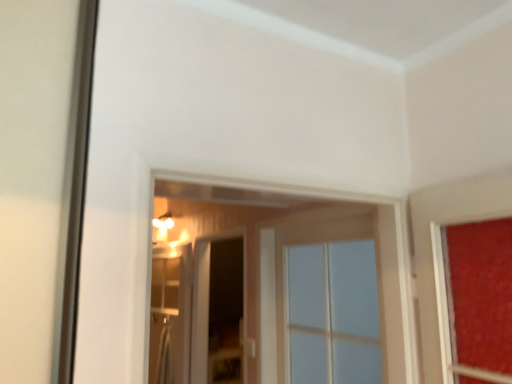
Locate an element on the screen. clear glass window at center is located at coordinates (328, 304).

Identify the location of clear glass screen door at center, marked as the 1th screen door in a right-to-left arrangement. Image resolution: width=512 pixels, height=384 pixels. (217, 311).

Where is `window in front of the clear glass screen door at center, marked as the 1th screen door in a right-to-left arrangement`? window in front of the clear glass screen door at center, marked as the 1th screen door in a right-to-left arrangement is located at coordinates (328, 304).

In terms of height, does clear glass window at center look taller or shorter compared to clear glass screen door at center, marked as the 1th screen door in a right-to-left arrangement?

Considering their sizes, clear glass window at center has less height than clear glass screen door at center, marked as the 1th screen door in a right-to-left arrangement.

Looking at their sizes, would you say clear glass window at center is wider or thinner than clear glass screen door at center, which ranks as the second screen door in left-to-right order?

In the image, clear glass window at center appears to be wider than clear glass screen door at center, which ranks as the second screen door in left-to-right order.

From a real-world perspective, who is located higher, clear glass screen door at center, arranged as the second screen door when viewed from the right, or clear glass window at center?

In real-world perspective, clear glass window at center is above.

Is clear glass screen door at center, arranged as the second screen door when viewed from the right, in front of or behind clear glass window at center in the image?

In the image, clear glass screen door at center, arranged as the second screen door when viewed from the right, appears behind clear glass window at center.

Considering the relative sizes of clear glass screen door at center, placed as the 1th screen door when sorted from left to right, and clear glass window at center in the image provided, is clear glass screen door at center, placed as the 1th screen door when sorted from left to right, smaller than clear glass window at center?

Indeed, clear glass screen door at center, placed as the 1th screen door when sorted from left to right, has a smaller size compared to clear glass window at center.

Consider the image. Is the depth of clear glass screen door at center, marked as the 1th screen door in a right-to-left arrangement, greater than that of clear glass window at center?

Yes, the depth of clear glass screen door at center, marked as the 1th screen door in a right-to-left arrangement, is greater than that of clear glass window at center.

The image size is (512, 384). Find the location of `the 1st screen door below the clear glass window at center (from the image's perspective)`. the 1st screen door below the clear glass window at center (from the image's perspective) is located at coordinates (217, 311).

Is clear glass screen door at center, marked as the 1th screen door in a right-to-left arrangement, to the left of clear glass window at center from the viewer's perspective?

Correct, you'll find clear glass screen door at center, marked as the 1th screen door in a right-to-left arrangement, to the left of clear glass window at center.

Looking at this image, from a real-world perspective, is clear glass window at center above or below clear glass screen door at center, placed as the 1th screen door when sorted from left to right?

Clearly, from a real-world perspective, clear glass window at center is above clear glass screen door at center, placed as the 1th screen door when sorted from left to right.

Which of these two, clear glass window at center or clear glass screen door at center, placed as the 1th screen door when sorted from left to right, stands taller?

clear glass screen door at center, placed as the 1th screen door when sorted from left to right, is taller.

Is clear glass window at center positioned with its back to clear glass screen door at center, placed as the 1th screen door when sorted from left to right?

No, clear glass screen door at center, placed as the 1th screen door when sorted from left to right, is not at the back of clear glass window at center.

From a real-world perspective, is clear glass screen door at center, arranged as the second screen door when viewed from the right, positioned over clear glass screen door at center, marked as the 1th screen door in a right-to-left arrangement, based on gravity?

No, from a real-world perspective, clear glass screen door at center, arranged as the second screen door when viewed from the right, is not above clear glass screen door at center, marked as the 1th screen door in a right-to-left arrangement.

Does point (163, 338) appear closer or farther from the camera than point (234, 239)?

Point (163, 338) appears to be farther away from the viewer than point (234, 239).

Is clear glass screen door at center, arranged as the second screen door when viewed from the right, positioned in front of clear glass screen door at center, marked as the 1th screen door in a right-to-left arrangement?

No, it is behind clear glass screen door at center, marked as the 1th screen door in a right-to-left arrangement.

Can you confirm if clear glass screen door at center, arranged as the second screen door when viewed from the right, is smaller than clear glass screen door at center, marked as the 1th screen door in a right-to-left arrangement?

Yes.

Can you confirm if clear glass screen door at center, which ranks as the second screen door in left-to-right order, is thinner than clear glass screen door at center, placed as the 1th screen door when sorted from left to right?

No.

Does point (234, 288) come in front of point (169, 269)?

No, it is not.

Are clear glass screen door at center, marked as the 1th screen door in a right-to-left arrangement, and clear glass screen door at center, arranged as the second screen door when viewed from the right, far apart?

They are positioned close to each other.

Which object is more forward, clear glass screen door at center, marked as the 1th screen door in a right-to-left arrangement, or clear glass screen door at center, placed as the 1th screen door when sorted from left to right?

Positioned in front is clear glass screen door at center, marked as the 1th screen door in a right-to-left arrangement.

This screenshot has width=512, height=384. There is a clear glass window at center. Identify the location of the 1st screen door below it (from the image's perspective). (217, 311).

Find the location of a particular element. The image size is (512, 384). screen door that is the 2nd one below the clear glass window at center (from a real-world perspective) is located at coordinates (170, 316).

Looking at the image, which one is located closer to clear glass window at center, clear glass screen door at center, arranged as the second screen door when viewed from the right, or clear glass screen door at center, which ranks as the second screen door in left-to-right order?

clear glass screen door at center, arranged as the second screen door when viewed from the right, is positioned closer to the anchor clear glass window at center.

Considering their positions, is clear glass screen door at center, marked as the 1th screen door in a right-to-left arrangement, positioned closer to clear glass screen door at center, arranged as the second screen door when viewed from the right, than clear glass window at center?

clear glass screen door at center, marked as the 1th screen door in a right-to-left arrangement, lies closer to clear glass screen door at center, arranged as the second screen door when viewed from the right, than the other object.

Looking at the image, which one is located further to clear glass screen door at center, marked as the 1th screen door in a right-to-left arrangement, clear glass screen door at center, arranged as the second screen door when viewed from the right, or clear glass window at center?

clear glass window at center is further to clear glass screen door at center, marked as the 1th screen door in a right-to-left arrangement.

Looking at this image, considering their positions, is clear glass window at center positioned further to clear glass screen door at center, which ranks as the second screen door in left-to-right order, than clear glass screen door at center, arranged as the second screen door when viewed from the right?

clear glass window at center is further to clear glass screen door at center, which ranks as the second screen door in left-to-right order.

Based on their spatial positions, is clear glass window at center or clear glass screen door at center, marked as the 1th screen door in a right-to-left arrangement, closer to clear glass screen door at center, placed as the 1th screen door when sorted from left to right?

Among the two, clear glass screen door at center, marked as the 1th screen door in a right-to-left arrangement, is located nearer to clear glass screen door at center, placed as the 1th screen door when sorted from left to right.

Estimate the real-world distances between objects in this image. Which object is closer to clear glass window at center, clear glass screen door at center, marked as the 1th screen door in a right-to-left arrangement, or clear glass screen door at center, arranged as the second screen door when viewed from the right?

The object closer to clear glass window at center is clear glass screen door at center, arranged as the second screen door when viewed from the right.

The image size is (512, 384). In order to click on screen door located between clear glass window at center and clear glass screen door at center, placed as the 1th screen door when sorted from left to right, in the depth direction in this screenshot , I will do `click(217, 311)`.